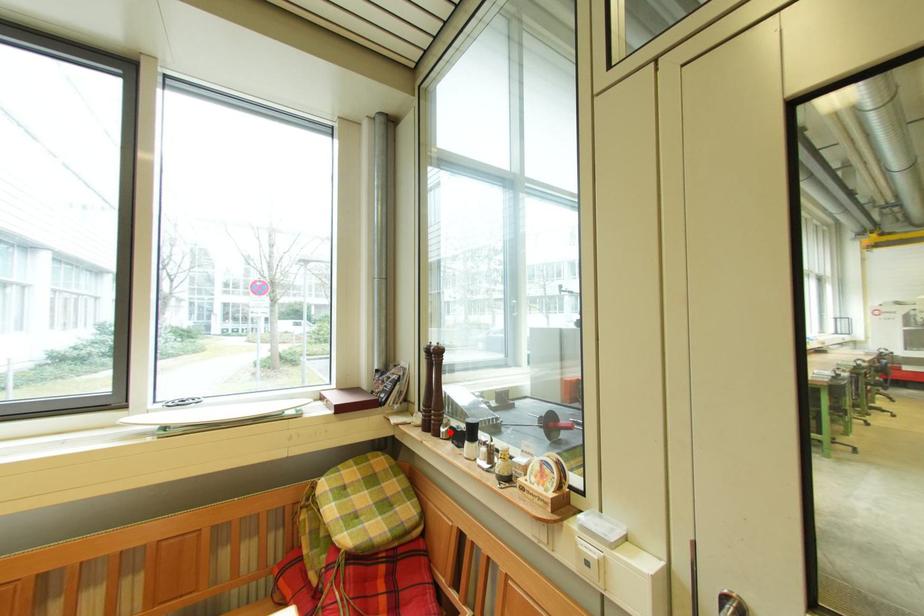
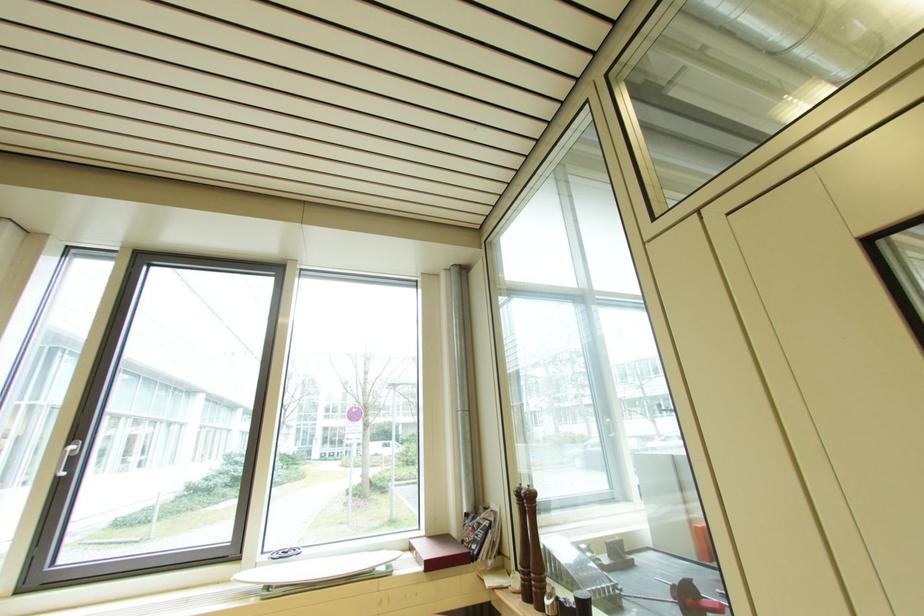
Find the pixel in the second image that matches the highlighted location in the first image.

(554, 605)